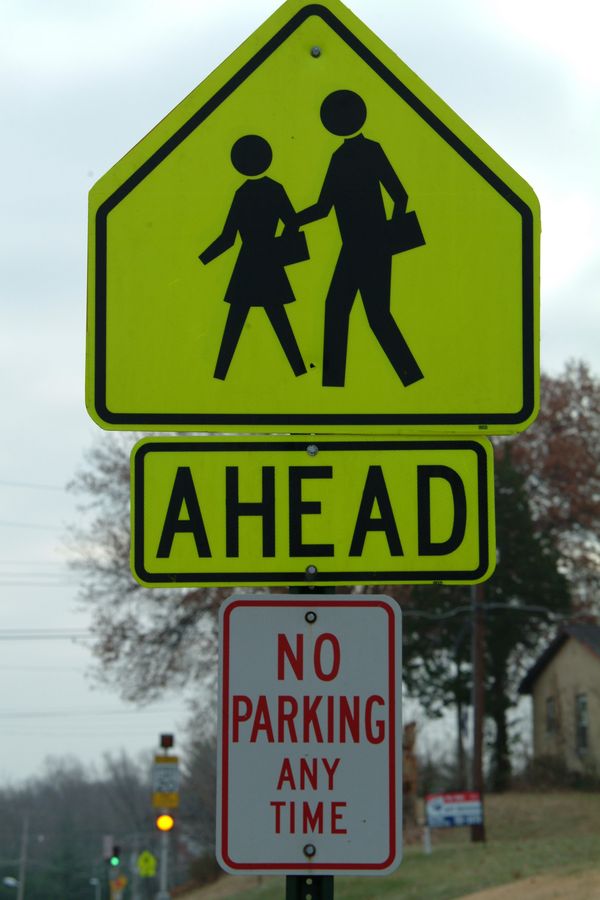
Identify the location of wall. This screenshot has height=900, width=600. point(571,670).